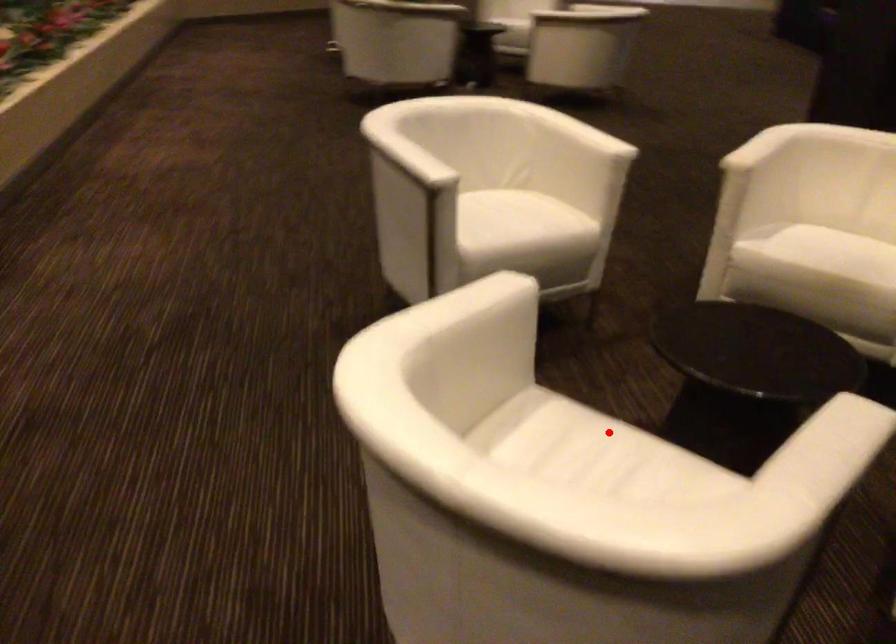
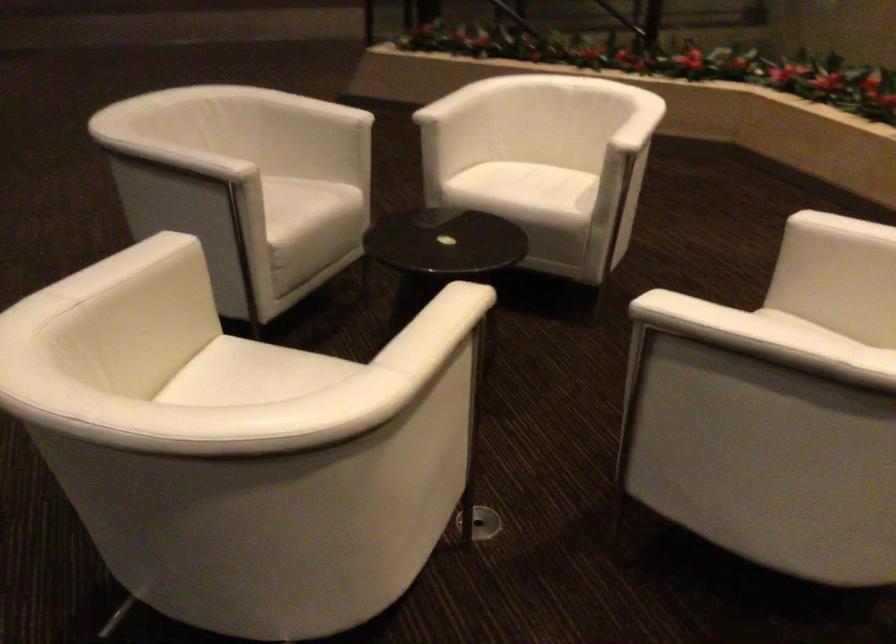
Question: I am providing you with two images of the same scene from different viewpoints. Given a red point in image1, look at the same physical point in image2. Is it:

Choices:
 (A) Closer to the viewpoint
 (B) Farther from the viewpoint

Answer: (B)